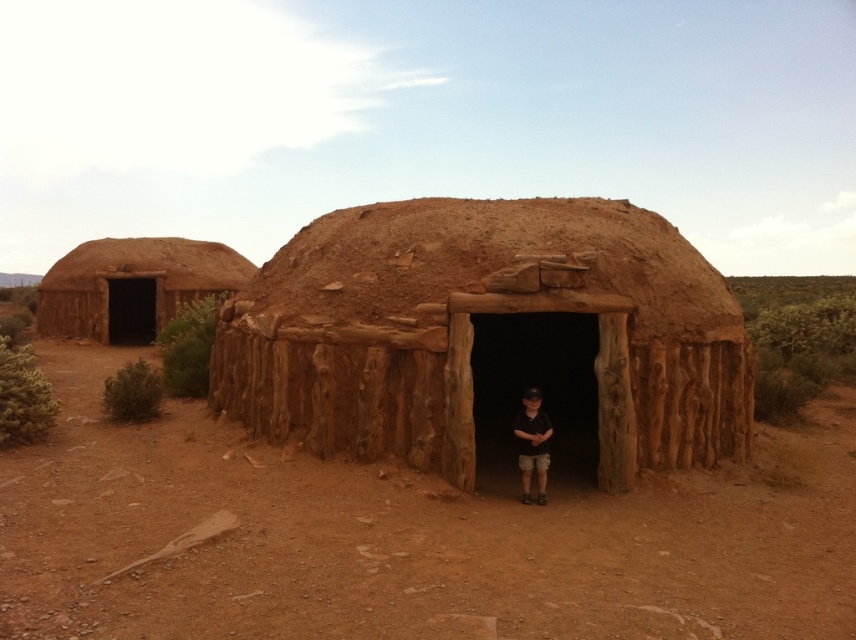
You are standing at the point marked as point (348, 368). You want to see the entrance of the adobe hut. Is the entrance visible from your current position?

The entrance is visible from point (348, 368) because the child is standing inside the open doorway facing the camera, indicating the entrance is unobstructed.

Based on the photo, you are a visitor standing outside the brown mud hut at center and the brown mud hut at left. You want to know which one is wider. Can you determine this based on the scene?

The brown mud hut at center is narrower than the brown mud hut at left, so the brown mud hut at left is wider.

In the scene shown: You are standing outside the brown mud hut at left and want to see the black cotton shirt at center. Which direction should you look relative to your current position?

The brown mud hut at left is located above the black cotton shirt at center, so you should look downward to see the black cotton shirt at center from your position outside the brown mud hut at left.